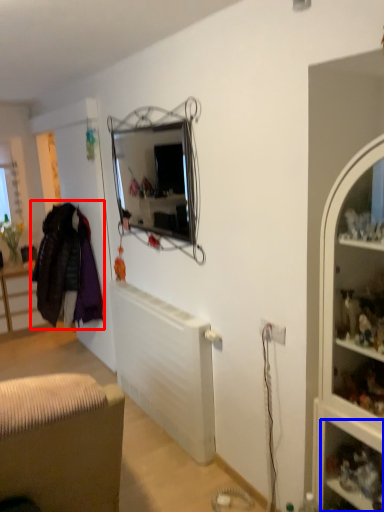
Question: Which object appears closest to the camera in this image, clothing (highlighted by a red box) or shelf (highlighted by a blue box)?

Choices:
 (A) clothing
 (B) shelf

Answer: (B)